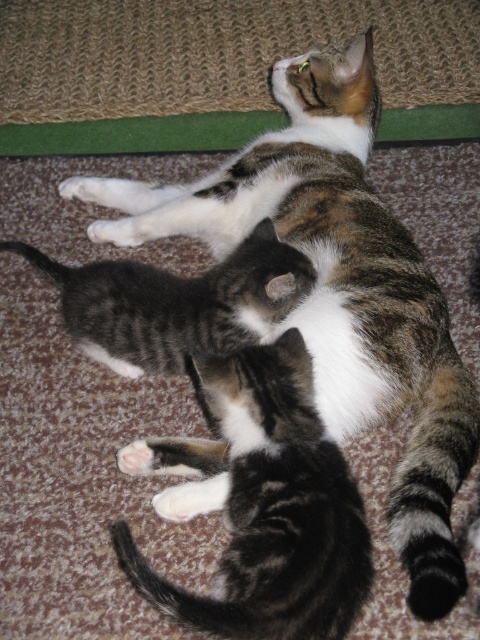
You are a cat owner who wants to ensure both kittens have enough space to move comfortably. Given that the distance between the striped fur kitten at center and the gray striped kitten at center is 11.68 inches, can you determine if there is enough space between them for each to move without disturbing the other?

The distance between the striped fur kitten at center and the gray striped kitten at center is 11.68 inches. This space should be sufficient for both kittens to move comfortably without disturbing each other, as they typically require around 8 to 10 inches of personal space.

Looking at this image, you are a cat owner who wants to place both kittens on a 15 cm wide shelf. The striped fur kitten at center and the gray striped kitten at center are both in the center. Can both fit side by side?

The striped fur kitten at center has a lesser width compared to gray striped kitten at center. However, since both kittens are at the center, their combined width may exceed the shelf space. Without exact measurements, it is uncertain if they can fit side by side on the 15 cm shelf.